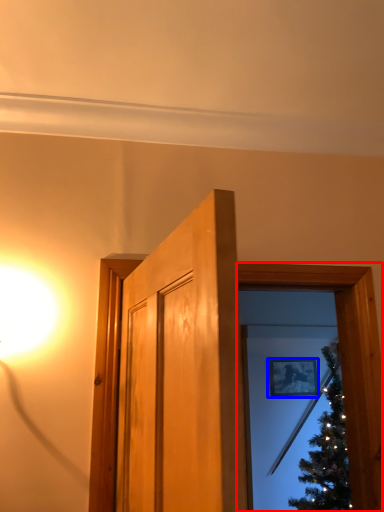
Question: Which point is further to the camera, window frame (highlighted by a red box) or picture frame (highlighted by a blue box)?

Choices:
 (A) window frame
 (B) picture frame

Answer: (B)